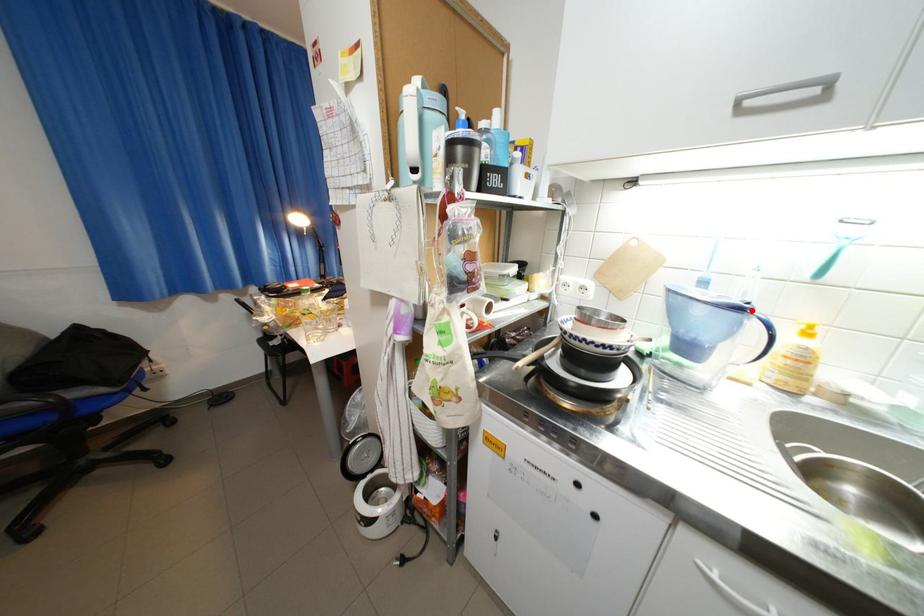
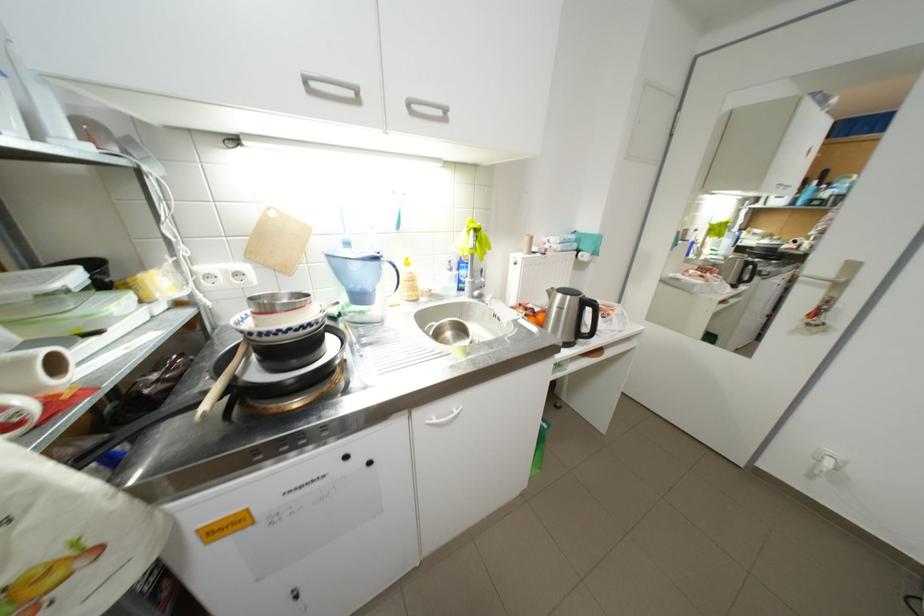
The point at the highlighted location is marked in the first image. Where is the corresponding point in the second image?

(387, 259)